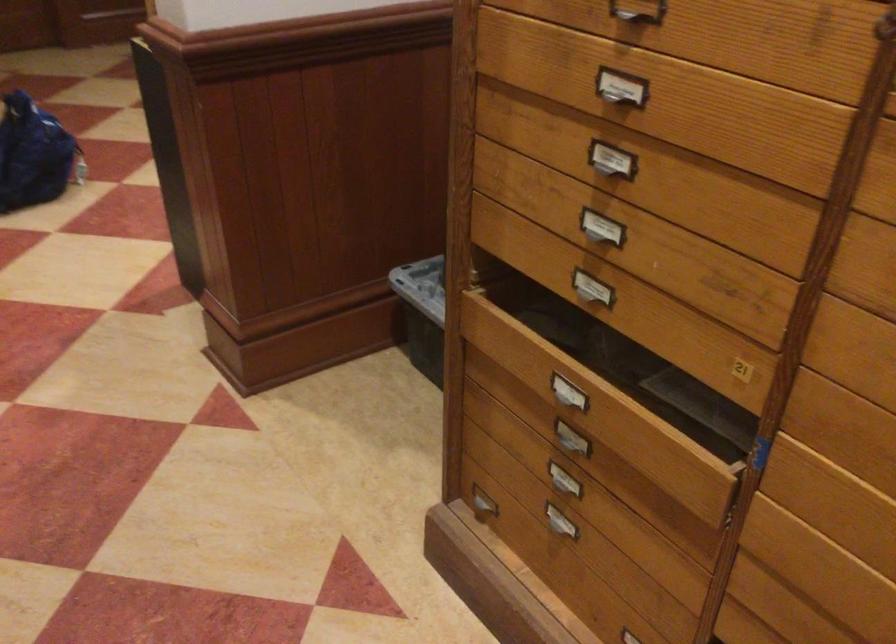
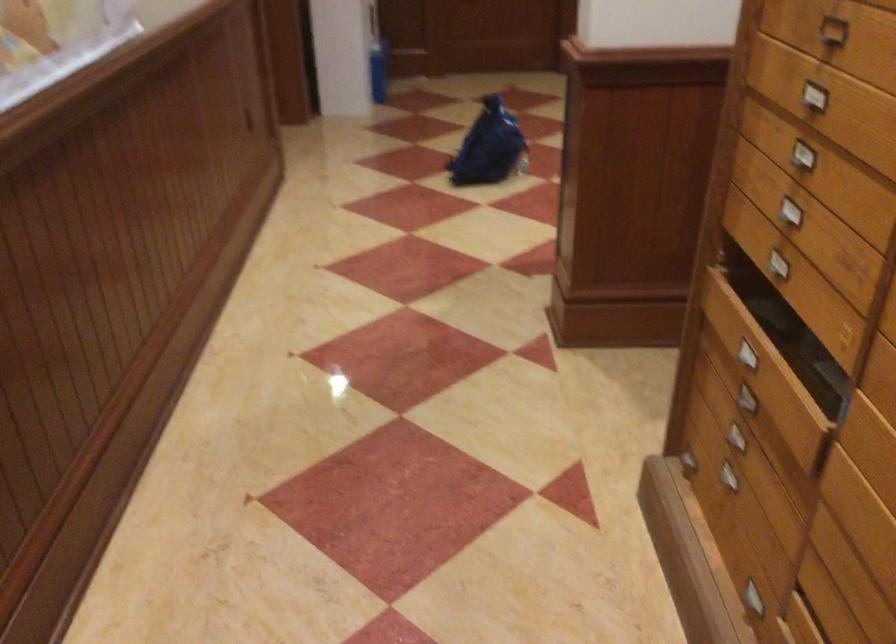
The point at (x=586, y=285) is marked in the first image. Where is the corresponding point in the second image?

(780, 261)